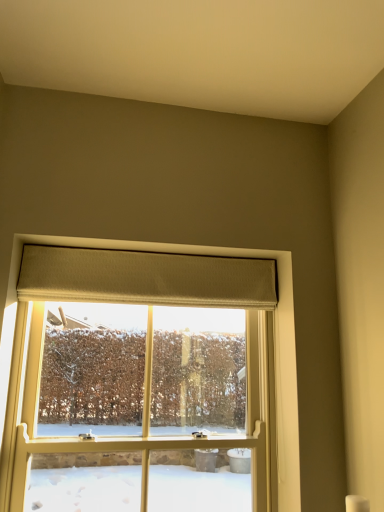
Describe the element at coordinates (274, 340) in the screenshot. This screenshot has height=512, width=384. I see `clear glass window at center` at that location.

I want to click on clear glass window at center, so click(x=274, y=340).

Describe the element at coordinates (145, 277) in the screenshot. This screenshot has height=512, width=384. I see `beige textured curtain at upper center` at that location.

What is the approximate width of beige textured curtain at upper center?

beige textured curtain at upper center is 2.59 inches in width.

Locate an element on the screen. This screenshot has width=384, height=512. beige textured curtain at upper center is located at coordinates (145, 277).

Locate an element on the screen. The width and height of the screenshot is (384, 512). clear glass window at center is located at coordinates (274, 340).

Which object is positioned more to the right, clear glass window at center or beige textured curtain at upper center?

From the viewer's perspective, beige textured curtain at upper center appears more on the right side.

Considering the positions of objects clear glass window at center and beige textured curtain at upper center in the image provided, who is in front, clear glass window at center or beige textured curtain at upper center?

Positioned in front is clear glass window at center.

Is point (296, 432) closer to viewer compared to point (263, 280)?

Yes, point (296, 432) is in front of point (263, 280).

From the image's perspective, is clear glass window at center positioned above or below beige textured curtain at upper center?

From the image's perspective, clear glass window at center appears below beige textured curtain at upper center.

From a real-world perspective, does clear glass window at center sit lower than beige textured curtain at upper center?

Yes.

Which of these two, clear glass window at center or beige textured curtain at upper center, is thinner?

With smaller width is beige textured curtain at upper center.

Considering the sizes of objects clear glass window at center and beige textured curtain at upper center in the image provided, who is shorter, clear glass window at center or beige textured curtain at upper center?

Standing shorter between the two is beige textured curtain at upper center.

Who is bigger, clear glass window at center or beige textured curtain at upper center?

clear glass window at center is bigger.

Is clear glass window at center inside the boundaries of beige textured curtain at upper center, or outside?

clear glass window at center is not inside beige textured curtain at upper center, it's outside.

Is clear glass window at center beside beige textured curtain at upper center?

clear glass window at center and beige textured curtain at upper center are not in contact.

Is beige textured curtain at upper center at the back of clear glass window at center?

clear glass window at center is not turned away from beige textured curtain at upper center.

Can you tell me how much clear glass window at center and beige textured curtain at upper center differ in facing direction?

0.00104 degrees separate the facing orientations of clear glass window at center and beige textured curtain at upper center.

I want to click on window on the left of beige textured curtain at upper center, so click(274, 340).

Which object is positioned more to the left, beige textured curtain at upper center or clear glass window at center?

Positioned to the left is clear glass window at center.

Does beige textured curtain at upper center lie in front of clear glass window at center?

No, beige textured curtain at upper center is behind clear glass window at center.

In the scene shown: Which is farther from the camera, (x=72, y=276) or (x=72, y=241)?

The point (x=72, y=276) is behind.

From the image's perspective, is beige textured curtain at upper center located above clear glass window at center?

Correct, beige textured curtain at upper center appears higher than clear glass window at center in the image.

From a real-world perspective, which is physically above, beige textured curtain at upper center or clear glass window at center?

beige textured curtain at upper center is physically above.

Which object is thinner, beige textured curtain at upper center or clear glass window at center?

Thinner between the two is beige textured curtain at upper center.

Who is taller, beige textured curtain at upper center or clear glass window at center?

clear glass window at center.

Which of these two, beige textured curtain at upper center or clear glass window at center, is bigger?

Bigger between the two is clear glass window at center.

Is beige textured curtain at upper center not within clear glass window at center?

beige textured curtain at upper center is positioned outside clear glass window at center.

Is beige textured curtain at upper center positioned far away from clear glass window at center?

Actually, beige textured curtain at upper center and clear glass window at center are a little close together.

Is beige textured curtain at upper center oriented away from clear glass window at center?

No, beige textured curtain at upper center is not facing away from clear glass window at center.

How different are the orientations of beige textured curtain at upper center and clear glass window at center in degrees?

They differ by 0.00104 degrees in their facing directions.

How distant is beige textured curtain at upper center from clear glass window at center?

18.96 centimeters.

Locate an element on the screen. The image size is (384, 512). curtain above the clear glass window at center (from a real-world perspective) is located at coordinates (145, 277).

Locate an element on the screen. curtain that appears above the clear glass window at center (from the image's perspective) is located at coordinates (145, 277).

Find the location of a particular element. The width and height of the screenshot is (384, 512). curtain that appears above the clear glass window at center (from a real-world perspective) is located at coordinates (145, 277).